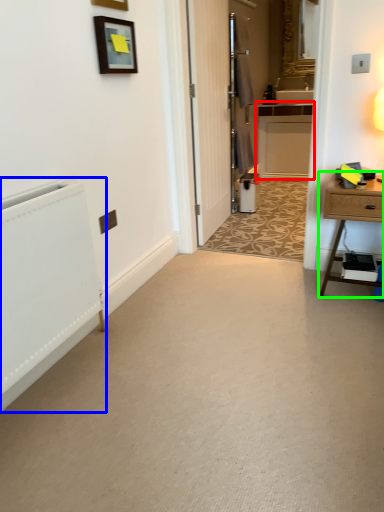
Question: Which is farther away from cabinetry (highlighted by a red box)? radiator (highlighted by a blue box) or nightstand (highlighted by a green box)?

Choices:
 (A) radiator
 (B) nightstand

Answer: (A)